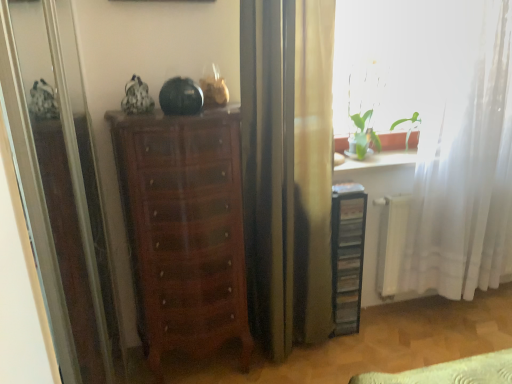
Locate an element on the screen. Image resolution: width=512 pixels, height=384 pixels. vacant space underneath shiny brown chest of drawers at center (from a real-world perspective) is located at coordinates (202, 368).